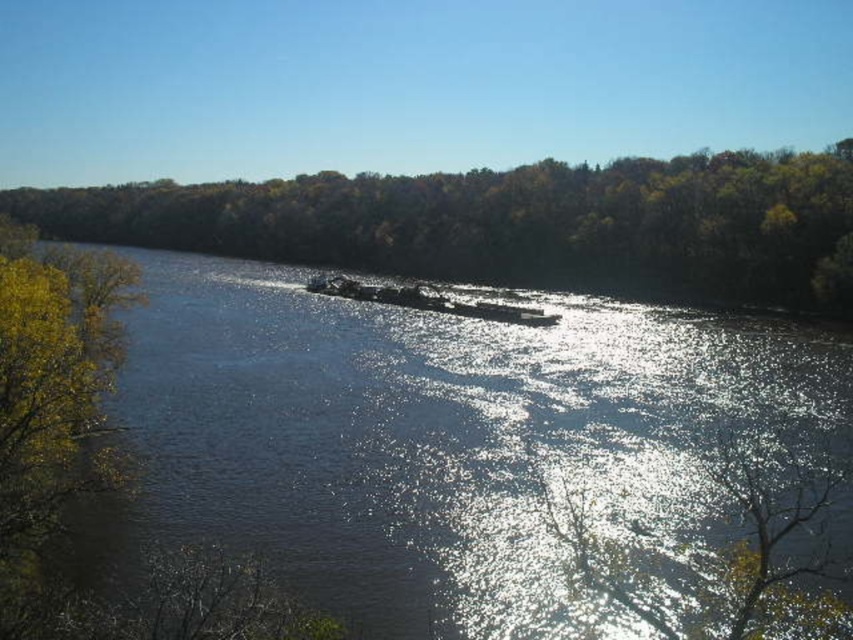
Which is in front, point (733, 516) or point (323, 275)?

Point (733, 516) is more forward.

Can you confirm if dark blue water at center is taller than metallic gray barge at center?

Yes.

Is point (532, 620) closer to camera compared to point (488, 308)?

That is True.

I want to click on dark blue water at center, so click(454, 449).

Does green leafy trees at center have a larger size compared to metallic gray barge at center?

Yes.

Where is `green leafy trees at center`? green leafy trees at center is located at coordinates (514, 224).

Is point (485, 481) farther from viewer compared to point (734, 256)?

No, (485, 481) is in front of (734, 256).

Looking at this image, who is more distant from viewer, (402, 472) or (432, 212)?

Point (432, 212)

Is point (239, 272) more distant than point (376, 259)?

That is False.

Image resolution: width=853 pixels, height=640 pixels. I want to click on dark blue water at center, so [454, 449].